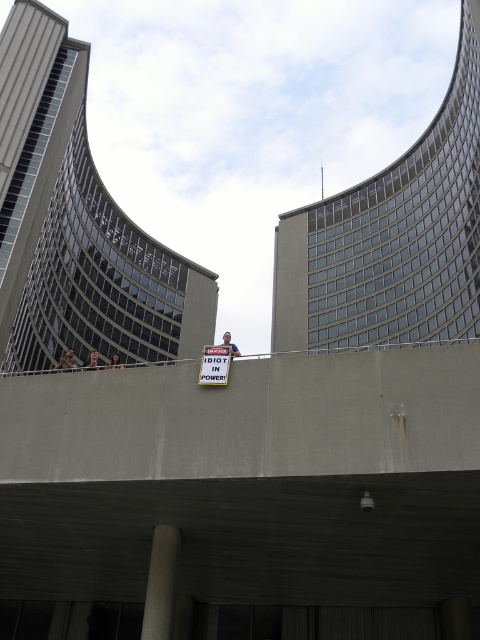
You are standing at the point labeled point (x=148, y=627) and want to walk to the point labeled point (x=222, y=362). Which direction should you move to get closer to your destination?

You should move away from the viewer to reach point (x=222, y=362) since point (x=148, y=627) is closer to the viewer than point (x=222, y=362).